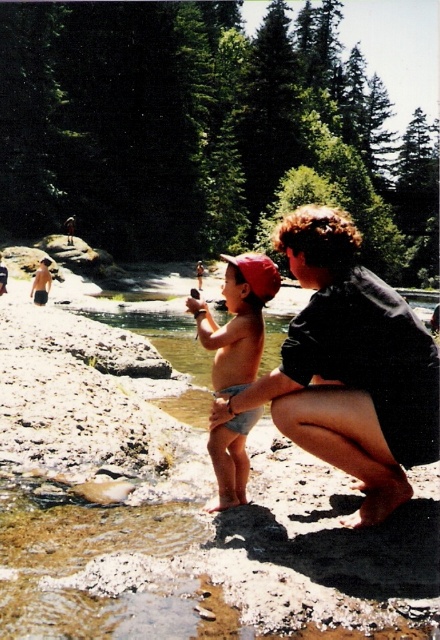
Does dark gray fabric at center have a lesser height compared to tan skin baby at center?

No, dark gray fabric at center is not shorter than tan skin baby at center.

Describe the element at coordinates (349, 368) in the screenshot. I see `dark gray fabric at center` at that location.

You are a GUI agent. You are given a task and a screenshot of the screen. Output one action in this format:
    pyautogui.click(x=<x>, y=<y>)
    Task: Click on the dark gray fabric at center
    
    Given the screenshot: What is the action you would take?
    click(x=349, y=368)